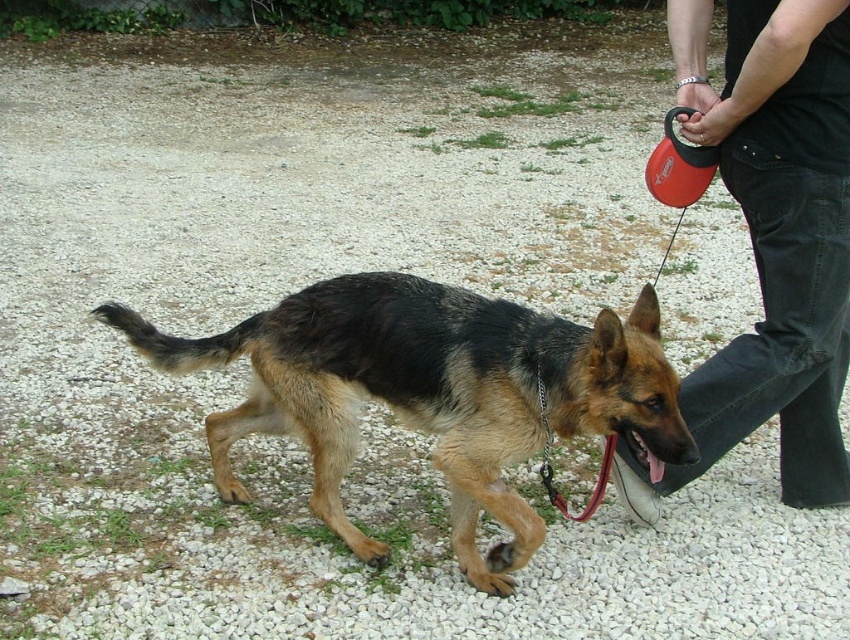
What is located at the coordinates point (432,392) in the image?

The black and tan fur dog at center is located at point (432,392).

You are standing on the gravel path and see the black and tan fur dog at center and the dark blue jeans at right. Which object is closer to your left side?

The black and tan fur dog at center is closer to your left side because it is positioned to the left of the dark blue jeans at right.

Based on the photo, you are a photographer trying to capture a portrait of the black and tan fur dog at center and the dark blue jeans at right. Based on their heights, which one should you focus on first if you want both subjects to be in focus without adjusting the camera settings?

The black and tan fur dog at center is shorter than the dark blue jeans at right, so you should focus on the dark blue jeans at right first to ensure both are in focus.